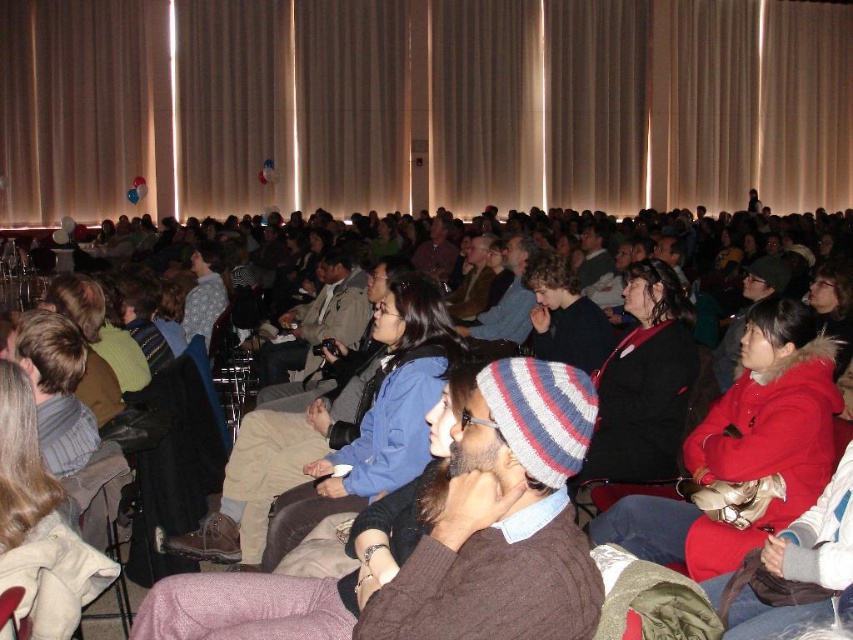
Which is more to the left, red fuzzy coat at center or striped knit beanie at center?

striped knit beanie at center is more to the left.

Find the location of a particular element. red fuzzy coat at center is located at coordinates (746, 448).

Can you confirm if dark blue knit hat at center is wider than striped knit beanie at center?

Yes.

Between dark blue knit hat at center and striped knit beanie at center, which one has more height?

dark blue knit hat at center is taller.

Locate an element on the screen. This screenshot has width=853, height=640. dark blue knit hat at center is located at coordinates (643, 381).

Find the location of `dark blue knit hat at center`. dark blue knit hat at center is located at coordinates (643, 381).

In the scene shown: Does knitted wool beanie at center appear under blue cotton jacket at center?

Indeed, knitted wool beanie at center is positioned under blue cotton jacket at center.

What do you see at coordinates (442, 540) in the screenshot? This screenshot has width=853, height=640. I see `knitted wool beanie at center` at bounding box center [442, 540].

Does point (506, 588) come behind point (389, 337)?

That is False.

Locate an element on the screen. The image size is (853, 640). knitted wool beanie at center is located at coordinates (442, 540).